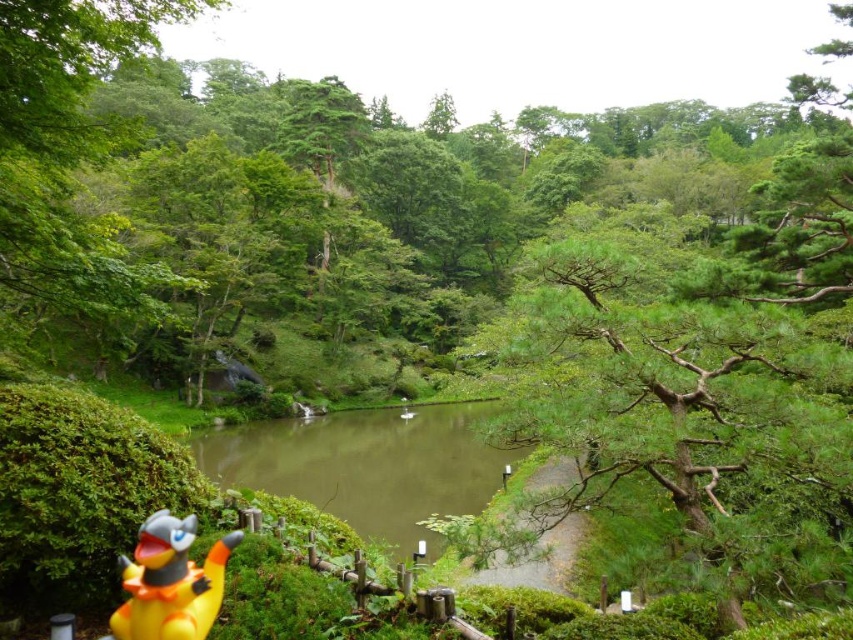
Question: Does green murky water at center have a greater width compared to yellow rubber duck at lower left?

Choices:
 (A) yes
 (B) no

Answer: (A)

Question: Is green murky water at center bigger than yellow rubber duck at lower left?

Choices:
 (A) yes
 (B) no

Answer: (A)

Question: Observing the image, what is the correct spatial positioning of green murky water at center in reference to yellow rubber duck at lower left?

Choices:
 (A) right
 (B) left

Answer: (B)

Question: Among these objects, which one is farthest from the camera?

Choices:
 (A) green murky water at center
 (B) yellow rubber duck at lower left

Answer: (A)